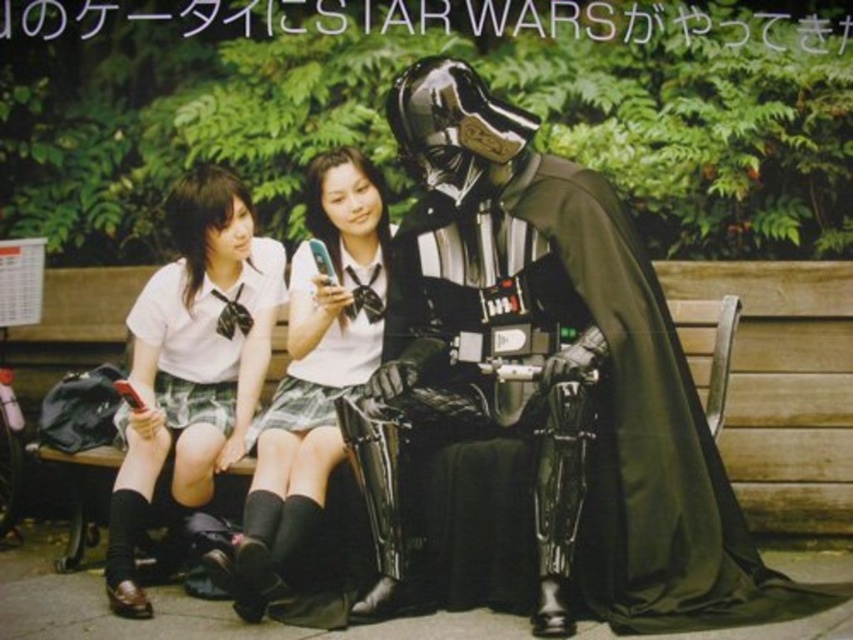
You are a photographer trying to capture a portrait of the two students sitting on the bench. The white glossy uniform at center is reflecting light. Where should you position your camera to avoid glare from the uniform?

The white glossy uniform at center is positioned at point [192,362], so you should position your camera away from that point to avoid glare.

Looking at this image, you are a tailor who needs to know which item requires more fabric to make between the white glossy uniform at center and the white fabric skirt at center. Based on the scene description, which one would need more fabric?

The white glossy uniform at center requires more fabric because its width is larger than the white fabric skirt at center.